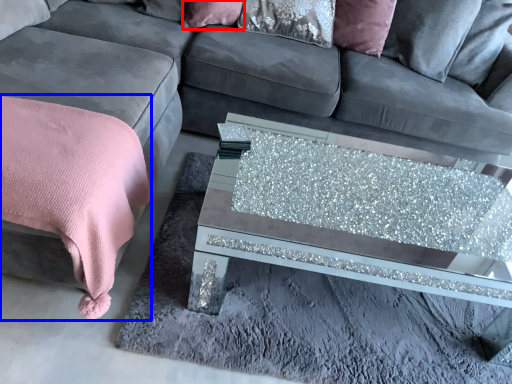
Question: Which object is closer to the camera taking this photo, pillow (highlighted by a red box) or blanket (highlighted by a blue box)?

Choices:
 (A) pillow
 (B) blanket

Answer: (B)